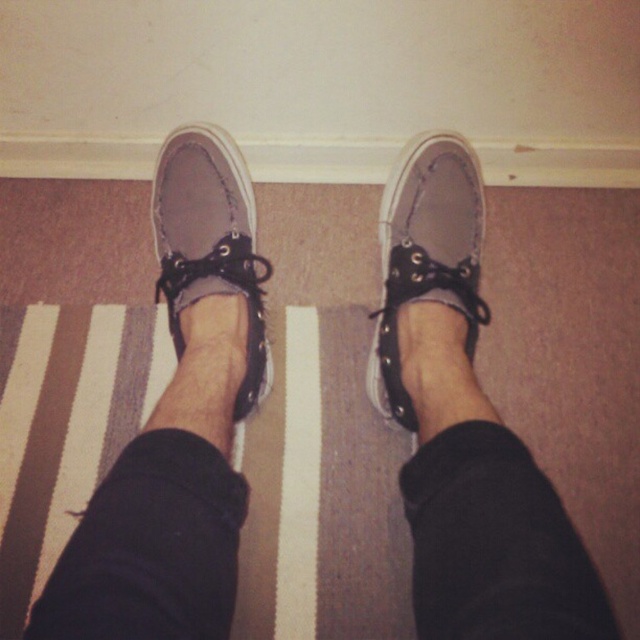
Identify the location of matte gray ankle at center. (470, 474).

Is matte gray ankle at center taller than black suede ankle at center?

Indeed, matte gray ankle at center has a greater height compared to black suede ankle at center.

Does point (529, 456) lie in front of point (211, 509)?

No, (529, 456) is further to viewer.

Locate an element on the screen. matte gray ankle at center is located at coordinates (470, 474).

Describe the element at coordinates (211, 241) in the screenshot. This screenshot has width=640, height=640. I see `gray suede shoe at center` at that location.

Based on the photo, is gray suede shoe at center behind matte gray ankle at center?

Yes.

Is point (252, 289) closer to viewer compared to point (516, 481)?

No.

Image resolution: width=640 pixels, height=640 pixels. In order to click on gray suede shoe at center in this screenshot , I will do `click(211, 241)`.

Does matte gray canvas shoe at center have a greater height compared to gray suede shoe at center?

Correct, matte gray canvas shoe at center is much taller as gray suede shoe at center.

Is matte gray canvas shoe at center shorter than gray suede shoe at center?

In fact, matte gray canvas shoe at center may be taller than gray suede shoe at center.

Between point (451, 272) and point (253, 298), which one is positioned in front?

Point (451, 272) is in front.

I want to click on matte gray canvas shoe at center, so click(426, 256).